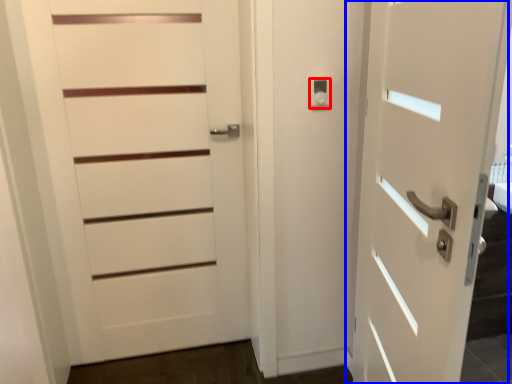
Question: Among these objects, which one is farthest to the camera, knob (highlighted by a red box) or door (highlighted by a blue box)?

Choices:
 (A) knob
 (B) door

Answer: (A)